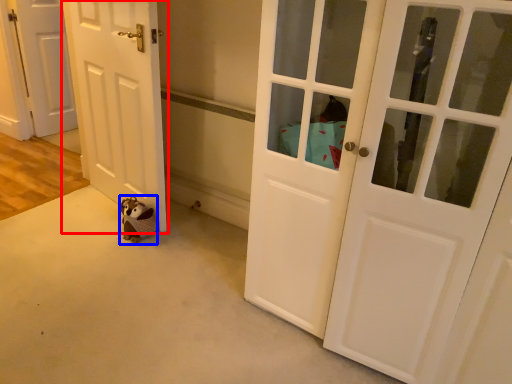
Question: Which point is further to the camera, door (highlighted by a red box) or animal (highlighted by a blue box)?

Choices:
 (A) door
 (B) animal

Answer: (B)